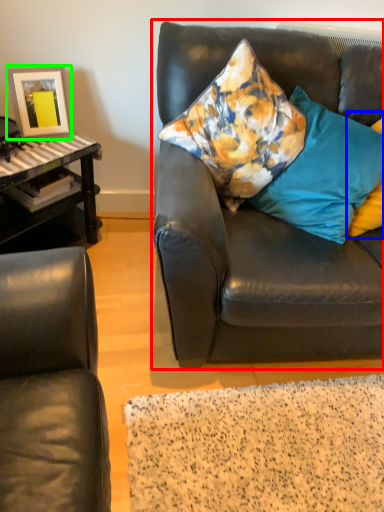
Question: Which is nearer to the studio couch (highlighted by a red box)? pillow (highlighted by a blue box) or picture frame (highlighted by a green box).

Choices:
 (A) pillow
 (B) picture frame

Answer: (A)